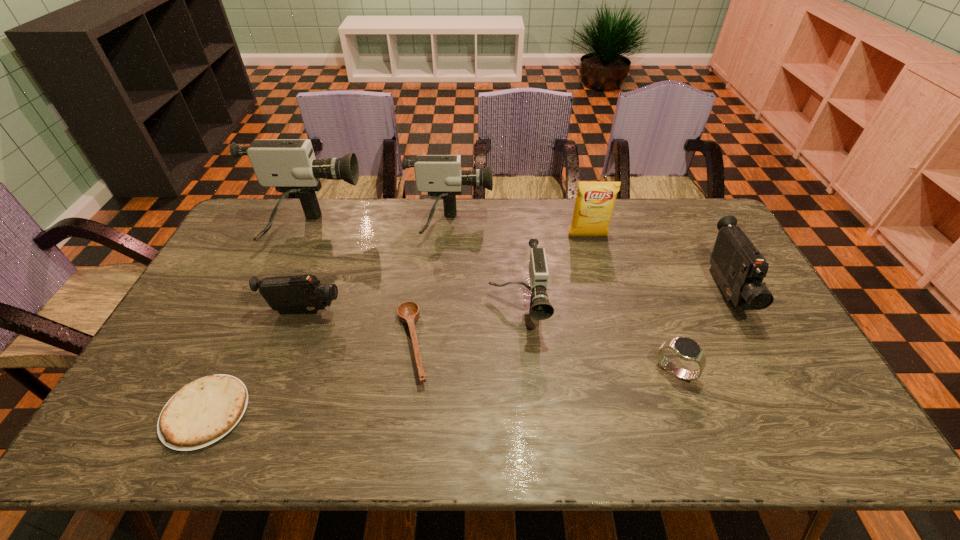
I want to click on watch, so click(x=685, y=348).

The image size is (960, 540). Identify the location of wooden spoon. (408, 312).

Image resolution: width=960 pixels, height=540 pixels. In order to click on brown wooden spoon in this screenshot , I will do `click(408, 312)`.

Identify the location of the shortest object. (202, 412).

This screenshot has height=540, width=960. Identify the location of tortilla. (202, 412).

You are a GUI agent. You are given a task and a screenshot of the screen. Output one action in this format:
    pyautogui.click(x=<x>, y=<y>)
    Task: Click on the free space located 0.060m on the recording direction of the tallest object
    The height and width of the screenshot is (540, 960).
    Given the screenshot: What is the action you would take?
    (378, 231)

This screenshot has height=540, width=960. Identify the location of free spot located 0.220m on the recording direction of the fourth shortest camcorder. (554, 227).

Where is `free spot located on the front of the seventh object from left to right with the logo`? This screenshot has height=540, width=960. free spot located on the front of the seventh object from left to right with the logo is located at coordinates (593, 256).

At what (x,y) coordinates should I click in order to perform the action: click on vacant space located on the front-facing side of the bigger black camcorder. Please return your answer as a coordinate pair (x, y). Looking at the image, I should click on (801, 433).

The image size is (960, 540). In order to click on free spot located 0.110m on the recording direction of the nearest white camcorder in this screenshot , I will do `click(522, 375)`.